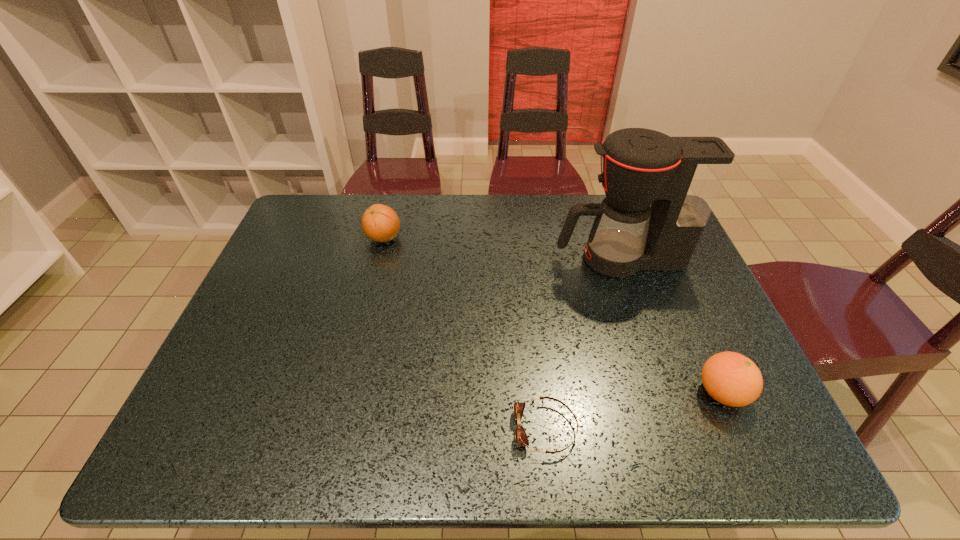
Where is `free point that satisfies the following two spatial constraints: 1. on the front side of the nearer orange; 2. through the lenses of the second object from left to right`? free point that satisfies the following two spatial constraints: 1. on the front side of the nearer orange; 2. through the lenses of the second object from left to right is located at coordinates (738, 429).

Locate an element on the screen. This screenshot has width=960, height=540. vacant region that satisfies the following two spatial constraints: 1. pour from the carafe of the coffee maker; 2. on the right side of the nearer orange is located at coordinates (664, 393).